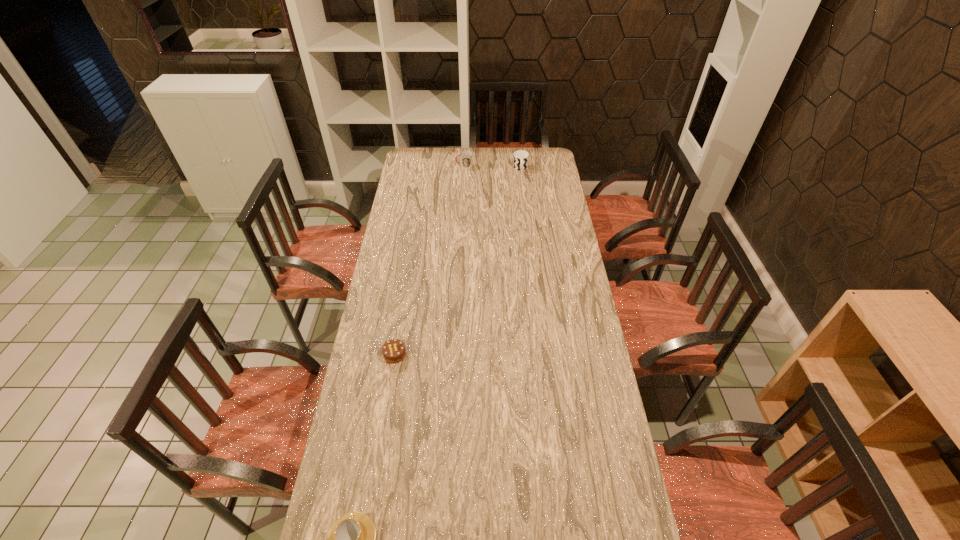
Find the location of a particular element. free space at the left edge of the desktop is located at coordinates (376, 347).

What are the coordinates of `free space at the right edge of the desktop` in the screenshot? It's located at (563, 258).

This screenshot has height=540, width=960. I want to click on free space that is in between the second cup from left to right and the second nearest object, so click(x=429, y=260).

Locate an element on the screen. The height and width of the screenshot is (540, 960). empty space that is in between the chocolate cake and the second cup from left to right is located at coordinates (429, 260).

Locate an element on the screen. free spot between the second cup from left to right and the rightmost cup is located at coordinates (492, 167).

You are a GUI agent. You are given a task and a screenshot of the screen. Output one action in this format:
    pyautogui.click(x=<x>, y=<y>)
    Task: Click on the blank region between the second cup from right to left and the second nearest object
    Image resolution: width=960 pixels, height=540 pixels.
    Given the screenshot: What is the action you would take?
    pyautogui.click(x=429, y=260)

Find the location of a particular element. The height and width of the screenshot is (540, 960). the closest object relative to the chocolate cake is located at coordinates (351, 539).

Locate which object is the closest to the second nearest object. Please provide its 2D coordinates. Your answer should be formatted as a tuple, i.e. [(x, y)], where the tuple contains the x and y coordinates of a point satisfying the conditions above.

[(351, 539)]

Choose which cup is the nearest neighbor to the rightmost cup. Please provide its 2D coordinates. Your answer should be formatted as a tuple, i.e. [(x, y)], where the tuple contains the x and y coordinates of a point satisfying the conditions above.

[(465, 156)]

Where is `cup that stands as the closest to the chocolate cake`? cup that stands as the closest to the chocolate cake is located at coordinates (x=351, y=539).